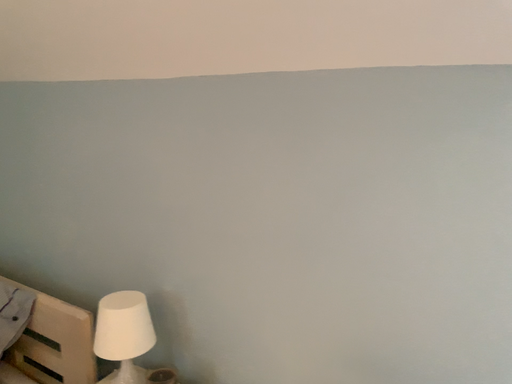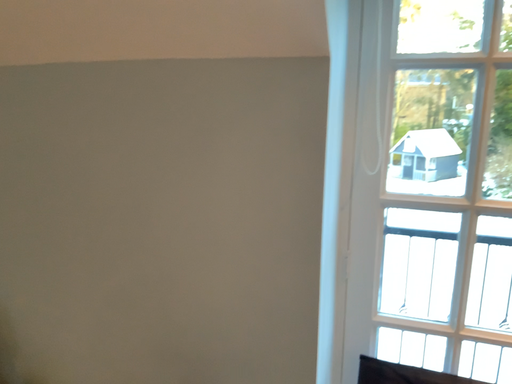
Question: How did the camera likely rotate when shooting the video?

Choices:
 (A) rotated right
 (B) rotated left

Answer: (A)